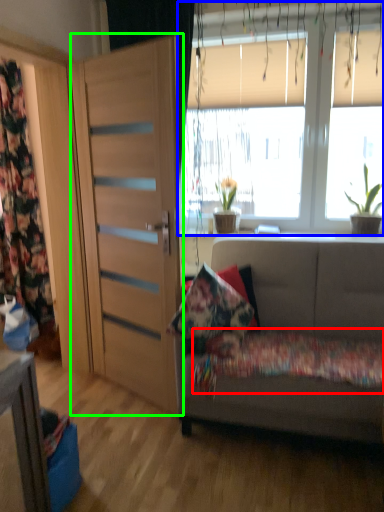
Question: Estimate the real-world distances between objects in this image. Which object is farther from bedding (highlighted by a red box), window (highlighted by a blue box) or door (highlighted by a green box)?

Choices:
 (A) window
 (B) door

Answer: (A)